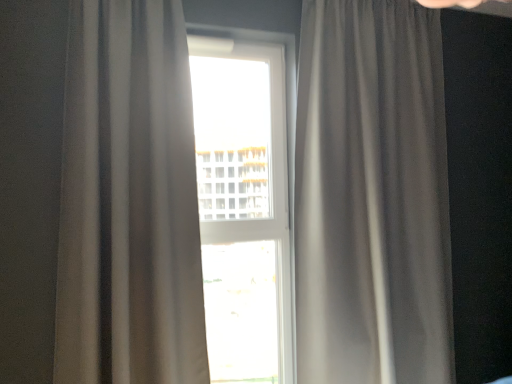
Question: From the image's perspective, is transparent glass window at center located beneath satin gray curtain at right, which is the 1th curtain in right-to-left order?

Choices:
 (A) no
 (B) yes

Answer: (B)

Question: Considering the relative sizes of transparent glass window at center and satin gray curtain at right, which is the 1th curtain in right-to-left order, in the image provided, is transparent glass window at center taller than satin gray curtain at right, which is the 1th curtain in right-to-left order,?

Choices:
 (A) no
 (B) yes

Answer: (A)

Question: Is transparent glass window at center directly adjacent to satin gray curtain at right, which is the 1th curtain in right-to-left order?

Choices:
 (A) yes
 (B) no

Answer: (B)

Question: Is satin gray curtain at right, which appears as the 2th curtain when viewed from the left, completely or partially inside transparent glass window at center?

Choices:
 (A) yes
 (B) no

Answer: (B)

Question: Can we say transparent glass window at center lies outside satin gray curtain at right, which is the 1th curtain in right-to-left order?

Choices:
 (A) yes
 (B) no

Answer: (A)

Question: Considering the relative positions of transparent glass window at center and satin gray curtain at right, which is the 1th curtain in right-to-left order, in the image provided, is transparent glass window at center in front of satin gray curtain at right, which is the 1th curtain in right-to-left order,?

Choices:
 (A) no
 (B) yes

Answer: (A)

Question: From the image's perspective, does matte gray curtain at center, arranged as the 1th curtain when viewed from the left, appear lower than satin gray curtain at right, which is the 1th curtain in right-to-left order?

Choices:
 (A) yes
 (B) no

Answer: (B)

Question: Is matte gray curtain at center, acting as the 2th curtain starting from the right, thinner than satin gray curtain at right, which appears as the 2th curtain when viewed from the left?

Choices:
 (A) yes
 (B) no

Answer: (A)

Question: Is matte gray curtain at center, acting as the 2th curtain starting from the right, in front of satin gray curtain at right, which is the 1th curtain in right-to-left order?

Choices:
 (A) yes
 (B) no

Answer: (A)

Question: Does matte gray curtain at center, acting as the 2th curtain starting from the right, appear on the right side of satin gray curtain at right, which is the 1th curtain in right-to-left order?

Choices:
 (A) yes
 (B) no

Answer: (B)

Question: Is matte gray curtain at center, arranged as the 1th curtain when viewed from the left, looking in the opposite direction of satin gray curtain at right, which is the 1th curtain in right-to-left order?

Choices:
 (A) no
 (B) yes

Answer: (A)

Question: Does matte gray curtain at center, acting as the 2th curtain starting from the right, contain satin gray curtain at right, which appears as the 2th curtain when viewed from the left?

Choices:
 (A) no
 (B) yes

Answer: (A)

Question: From the image's perspective, does matte gray curtain at center, arranged as the 1th curtain when viewed from the left, appear lower than transparent glass window at center?

Choices:
 (A) no
 (B) yes

Answer: (A)